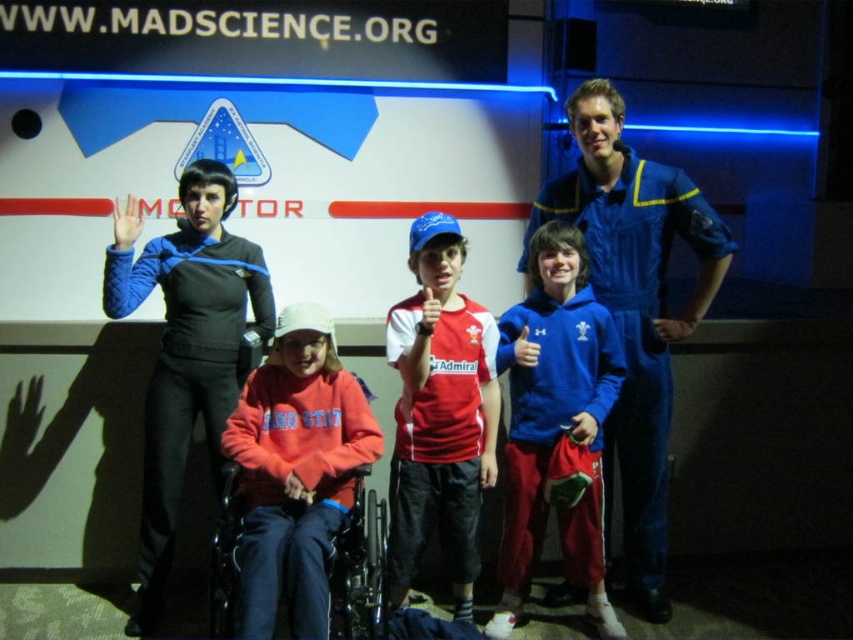
Question: Among these points, which one is farthest from the camera?

Choices:
 (A) (238, 529)
 (B) (181, 337)
 (C) (532, 545)

Answer: (C)

Question: Which of these objects is positioned closest to the black fabric uniform at left?

Choices:
 (A) blue fabric wheelchair at center
 (B) blue fleece at center
 (C) red cotton shirt at center

Answer: (A)

Question: Can you confirm if black fabric uniform at left is thinner than blue fabric wheelchair at center?

Choices:
 (A) yes
 (B) no

Answer: (A)

Question: Based on their relative distances, which object is farther from the blue jumpsuit at right?

Choices:
 (A) blue fleece at center
 (B) red cotton shirt at center
 (C) blue fabric wheelchair at center

Answer: (C)

Question: Does blue jumpsuit at right appear on the right side of red cotton shirt at center?

Choices:
 (A) no
 (B) yes

Answer: (B)

Question: Is black fabric uniform at left bigger than red cotton shirt at center?

Choices:
 (A) no
 (B) yes

Answer: (B)